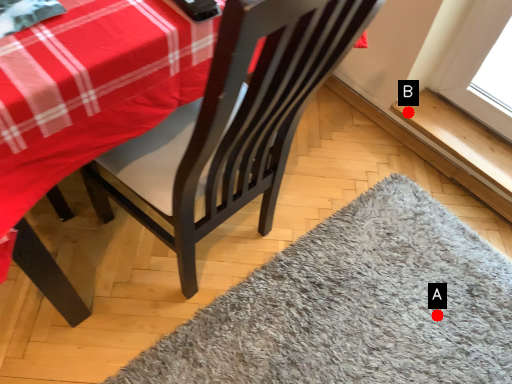
Question: Two points are circled on the image, labeled by A and B beside each circle. Among these points, which one is farthest from the camera?

Choices:
 (A) A is further
 (B) B is further

Answer: (B)